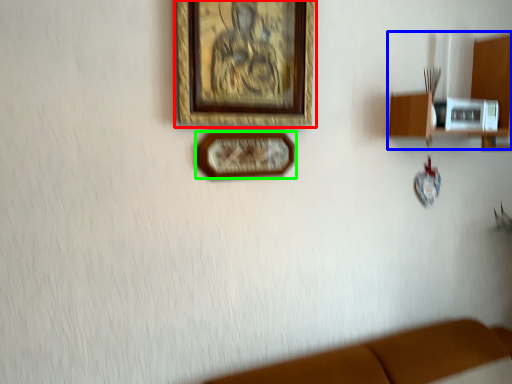
Question: Based on their relative distances, which object is farther from picture frame (highlighted by a red box)? Choose from shelf (highlighted by a blue box) and picture frame (highlighted by a green box).

Choices:
 (A) shelf
 (B) picture frame

Answer: (A)